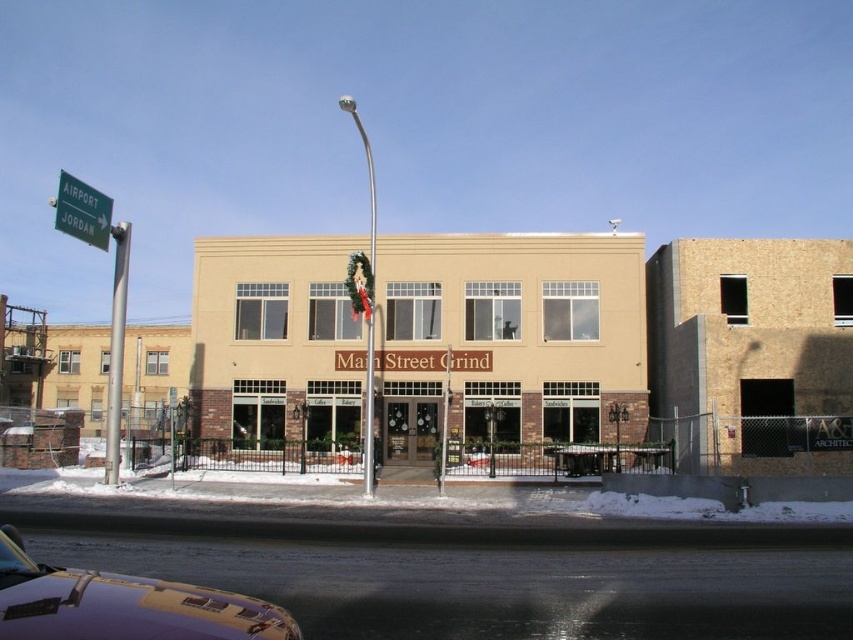
Is white powdery snow at lower center positioned at the back of metallic purple car at lower left?

Yes, white powdery snow at lower center is behind metallic purple car at lower left.

The height and width of the screenshot is (640, 853). What do you see at coordinates (410, 497) in the screenshot? I see `white powdery snow at lower center` at bounding box center [410, 497].

Where is `white powdery snow at lower center`? This screenshot has height=640, width=853. white powdery snow at lower center is located at coordinates (410, 497).

Is point (97, 476) positioned after point (109, 353)?

Yes, it is.

You are a GUI agent. You are given a task and a screenshot of the screen. Output one action in this format:
    pyautogui.click(x=<x>, y=<y>)
    Task: Click on the white powdery snow at lower center
    The image size is (853, 640).
    Given the screenshot: What is the action you would take?
    pyautogui.click(x=410, y=497)

Between point (132, 497) and point (109, 468), which one is positioned behind?

The point (109, 468) is more distant.

Locate an element on the screen. white powdery snow at lower center is located at coordinates (410, 497).

Is metallic purple car at lower left above silver metallic pole at left?

Incorrect, metallic purple car at lower left is not positioned above silver metallic pole at left.

What do you see at coordinates (122, 604) in the screenshot? I see `metallic purple car at lower left` at bounding box center [122, 604].

I want to click on metallic purple car at lower left, so click(122, 604).